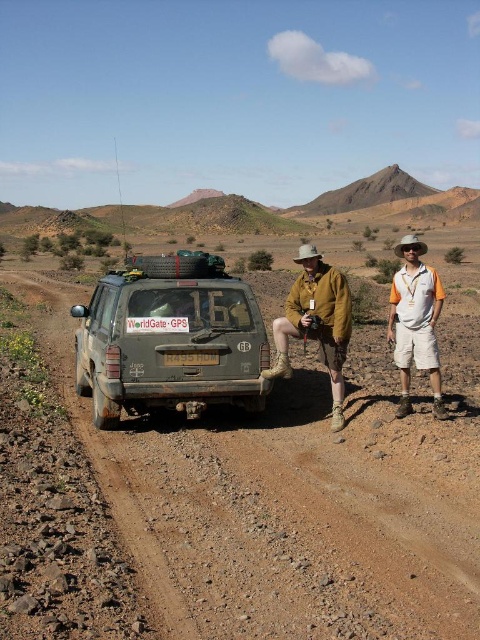
You are planning to drive a truck that is 2 meters wide. You see the brown gravel dirt track at center and the white plastic license plate at rear in the scene. Can the truck fit on the dirt track?

The brown gravel dirt track at center might be wider than the white plastic license plate at rear, so the truck that is 2 meters wide can likely fit on the dirt track since its width is possibly sufficient.

Looking at this image, you are a hiker who has just arrived at this desert location. You notice the dirty gray mud at center and the white cotton shorts at right. Which object is closer to you?

The dirty gray mud at center is closer to you than the white cotton shorts at right, as it is only 3.14 meters away.